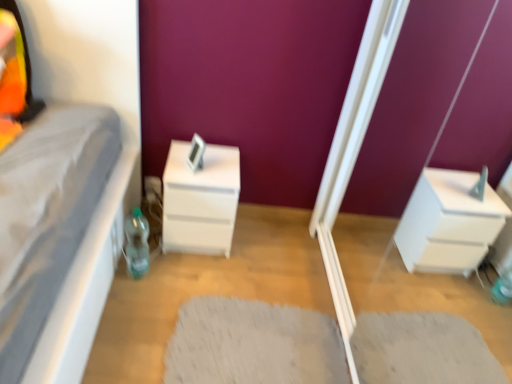
Question: Is white shaggy rug at center completely or partially outside of white glossy screen door at lower right?

Choices:
 (A) yes
 (B) no

Answer: (A)

Question: Does white shaggy rug at center lie behind white glossy screen door at lower right?

Choices:
 (A) yes
 (B) no

Answer: (A)

Question: Can you confirm if white shaggy rug at center is smaller than white glossy screen door at lower right?

Choices:
 (A) yes
 (B) no

Answer: (A)

Question: From the image's perspective, is white shaggy rug at center beneath white glossy screen door at lower right?

Choices:
 (A) yes
 (B) no

Answer: (A)

Question: Is white shaggy rug at center turned away from white glossy screen door at lower right?

Choices:
 (A) yes
 (B) no

Answer: (A)

Question: From a real-world perspective, is white shaggy rug at center above or below white glossy screen door at lower right?

Choices:
 (A) above
 (B) below

Answer: (B)

Question: Is white shaggy rug at center bigger or smaller than white glossy screen door at lower right?

Choices:
 (A) big
 (B) small

Answer: (B)

Question: Choose the correct answer: Is white shaggy rug at center inside white glossy screen door at lower right or outside it?

Choices:
 (A) outside
 (B) inside

Answer: (A)

Question: Is white shaggy rug at center taller or shorter than white glossy screen door at lower right?

Choices:
 (A) tall
 (B) short

Answer: (B)

Question: Considering the positions of white glossy screen door at lower right and translucent plastic bottle at lower left in the image, is white glossy screen door at lower right wider or thinner than translucent plastic bottle at lower left?

Choices:
 (A) thin
 (B) wide

Answer: (B)

Question: From their relative heights in the image, would you say white glossy screen door at lower right is taller or shorter than translucent plastic bottle at lower left?

Choices:
 (A) short
 (B) tall

Answer: (B)

Question: From a real-world perspective, is white glossy screen door at lower right positioned above or below translucent plastic bottle at lower left?

Choices:
 (A) above
 (B) below

Answer: (A)

Question: From the image's perspective, is white glossy screen door at lower right positioned above or below translucent plastic bottle at lower left?

Choices:
 (A) above
 (B) below

Answer: (A)

Question: From the image's perspective, is white shaggy rug at center positioned above or below translucent plastic bottle at lower left?

Choices:
 (A) above
 (B) below

Answer: (B)

Question: Is white shaggy rug at center wider or thinner than translucent plastic bottle at lower left?

Choices:
 (A) wide
 (B) thin

Answer: (A)